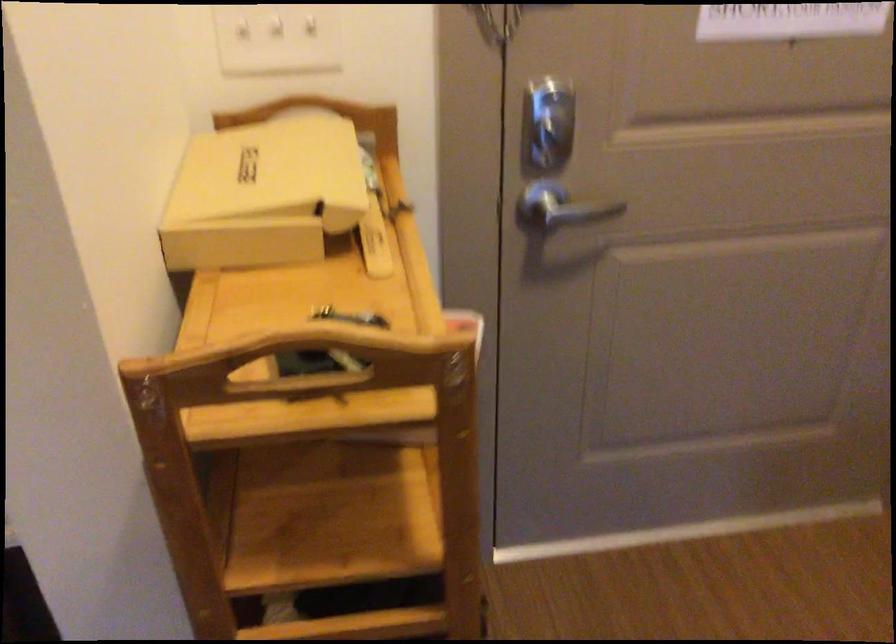
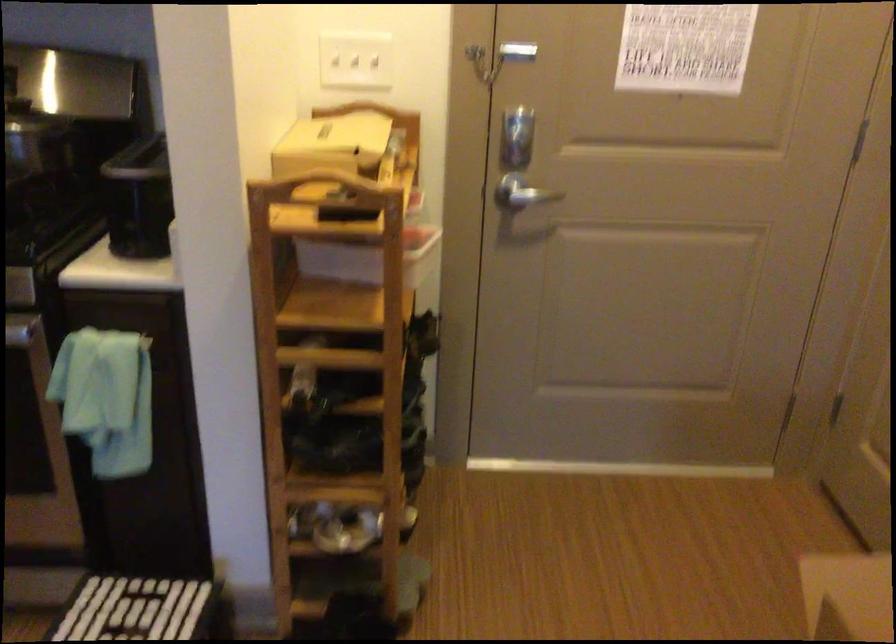
Where in the second image is the point corresponding to point 552,213 from the first image?

(521, 193)